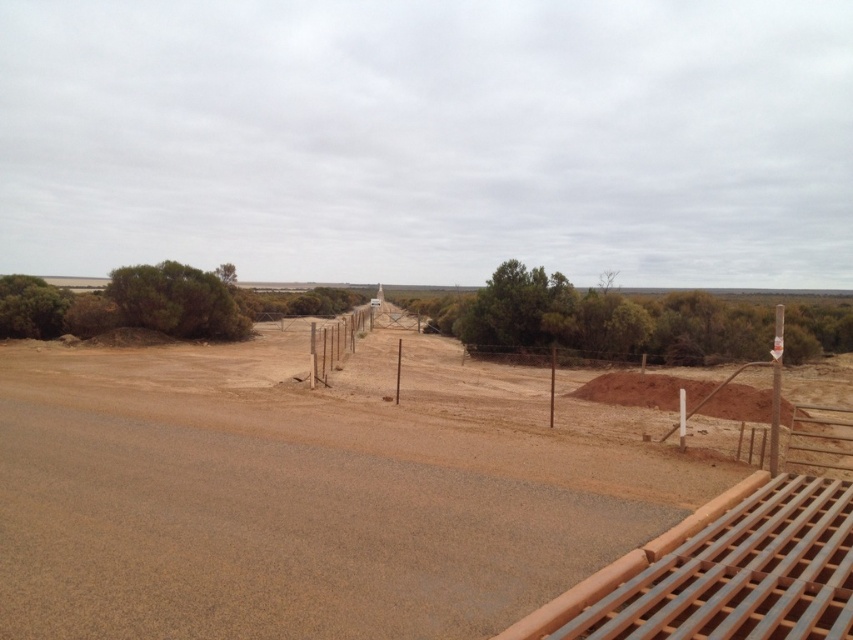
Which is more to the right, brown sandy dirt field at center or brown wire fence at center?

brown wire fence at center

Which is behind, point (178, 614) or point (572, 369)?

The point (572, 369) is behind.

Does point (12, 540) come in front of point (614, 433)?

Yes, it is.

At what (x,y) coordinates should I click in order to perform the action: click on brown sandy dirt field at center. Please return your answer as a coordinate pair (x, y). Looking at the image, I should click on (314, 492).